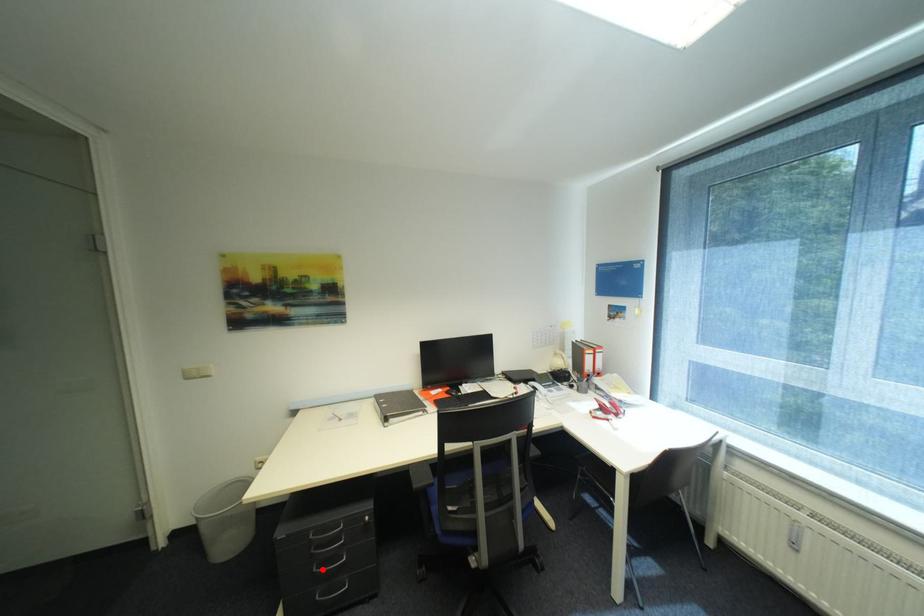
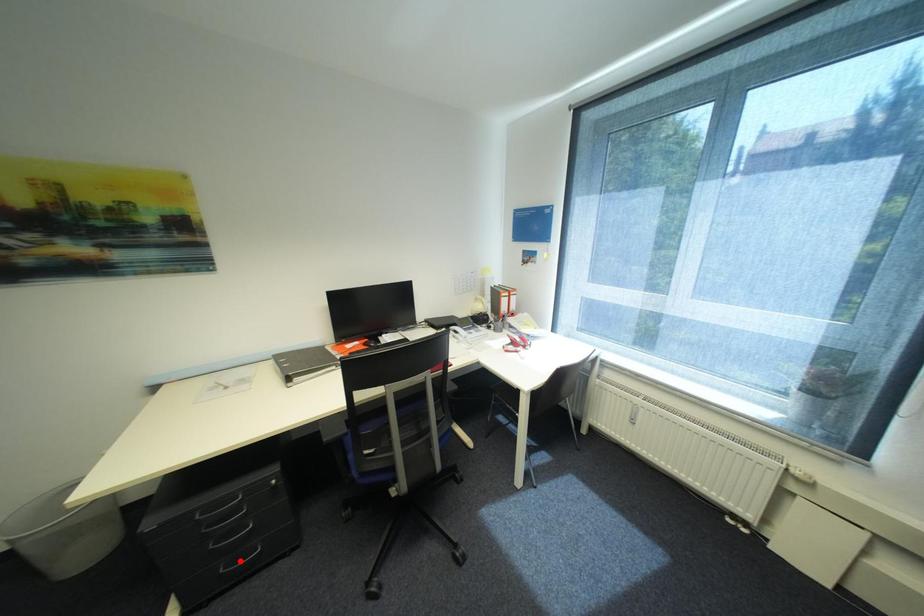
I am providing you with two images of the same scene from different viewpoints. A red point is marked on the first image and another point is marked on the second image. Are the points marked in image1 and image2 representing the same 3D position?

No